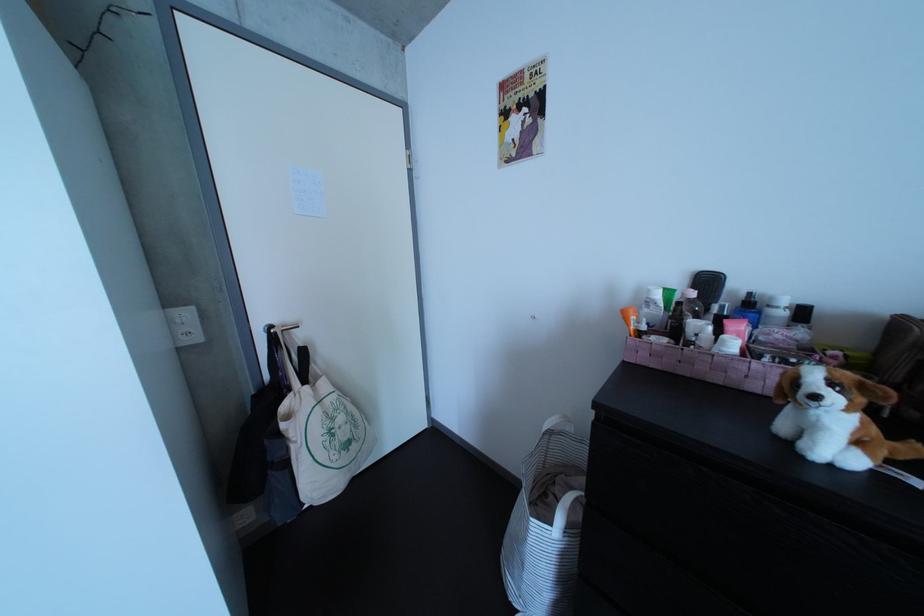
Where would you push the bottle pump top? Please return your answer as a coordinate pair (x, y).

(746, 297)